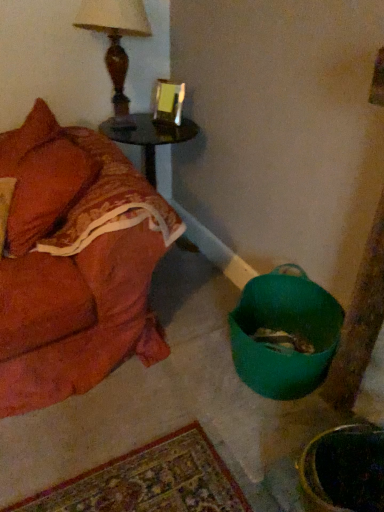
Question: Does velvet orange couch at left turn towards green plastic bucket at lower right?

Choices:
 (A) no
 (B) yes

Answer: (A)

Question: From the image's perspective, is velvet orange couch at left over green plastic bucket at lower right?

Choices:
 (A) yes
 (B) no

Answer: (A)

Question: Does velvet orange couch at left have a larger size compared to green plastic bucket at lower right?

Choices:
 (A) no
 (B) yes

Answer: (B)

Question: Is the depth of velvet orange couch at left less than that of green plastic bucket at lower right?

Choices:
 (A) no
 (B) yes

Answer: (B)

Question: Is velvet orange couch at left taller than green plastic bucket at lower right?

Choices:
 (A) no
 (B) yes

Answer: (B)

Question: From a real-world perspective, relative to green plastic bucket at lower right, is shiny dark wood side table at upper left vertically above or below?

Choices:
 (A) above
 (B) below

Answer: (A)

Question: From their relative heights in the image, would you say shiny dark wood side table at upper left is taller or shorter than green plastic bucket at lower right?

Choices:
 (A) short
 (B) tall

Answer: (B)

Question: Considering the positions of point (134, 132) and point (306, 369), is point (134, 132) closer or farther from the camera than point (306, 369)?

Choices:
 (A) farther
 (B) closer

Answer: (A)

Question: Considering the relative positions of shiny dark wood side table at upper left and green plastic bucket at lower right in the image provided, is shiny dark wood side table at upper left to the left or to the right of green plastic bucket at lower right?

Choices:
 (A) right
 (B) left

Answer: (B)

Question: In terms of width, does green plastic bucket at lower right look wider or thinner when compared to velvet orange couch at left?

Choices:
 (A) thin
 (B) wide

Answer: (A)

Question: Is point (339, 330) closer or farther from the camera than point (112, 246)?

Choices:
 (A) closer
 (B) farther

Answer: (B)

Question: Considering their positions, is green plastic bucket at lower right located in front of or behind velvet orange couch at left?

Choices:
 (A) behind
 (B) front

Answer: (A)

Question: Is green plastic bucket at lower right taller or shorter than velvet orange couch at left?

Choices:
 (A) tall
 (B) short

Answer: (B)

Question: From the image's perspective, is wooden table lamp at upper left positioned above or below velvet orange couch at left?

Choices:
 (A) below
 (B) above

Answer: (B)

Question: From a real-world perspective, is wooden table lamp at upper left positioned above or below velvet orange couch at left?

Choices:
 (A) below
 (B) above

Answer: (B)